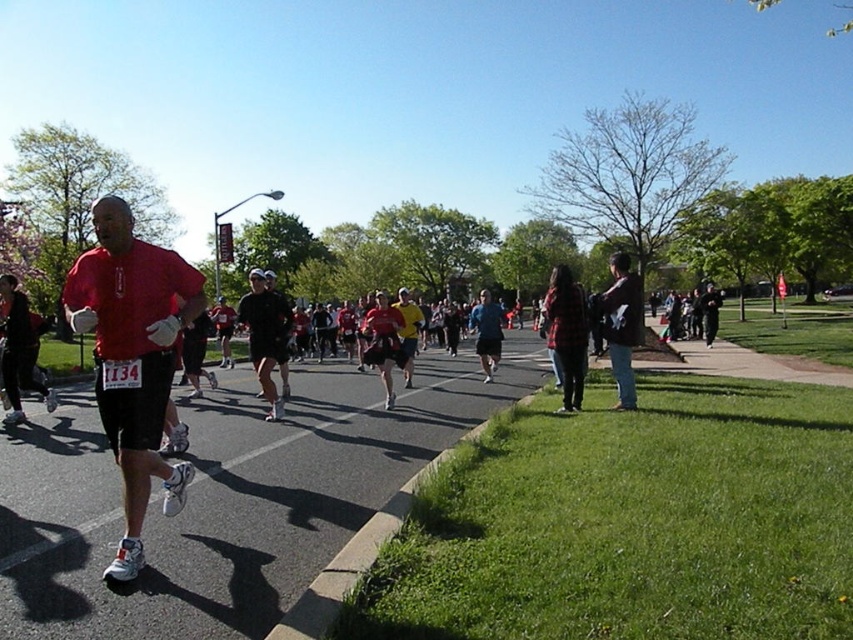
You are a photographer positioned at the side of the marathon route. You want to capture a photo of the runner wearing the yellow fabric shirt at center and the black matte shorts at center. Based on their positions, which clothing item should you focus on first to ensure both are in frame?

The black matte shorts at center is to the left of the yellow fabric shirt at center, so you should focus on the yellow fabric shirt at center first to ensure both are in frame as you pan from left to right.

You are a runner in the marathon and you want to pass through the gap between the black matte shorts at center and the yellow fabric shirt at center. Your body is 2 feet wide. Can you fit through the gap?

The distance between the black matte shorts at center and the yellow fabric shirt at center is 11.74 feet, which is wider than your 2 feet width. Therefore, you can comfortably pass through the gap between them.

You are a runner in the marathon and you want to take a photo with both the brown leather jacket at right and the yellow fabric shirt at center in the background. Which direction should you move to ensure both are visible in your camera frame?

The brown leather jacket at right is positioned on the right side of the yellow fabric shirt at center. To include both in your photo, move to the left so that the brown leather jacket at right and the yellow fabric shirt at center are within the camera frame.